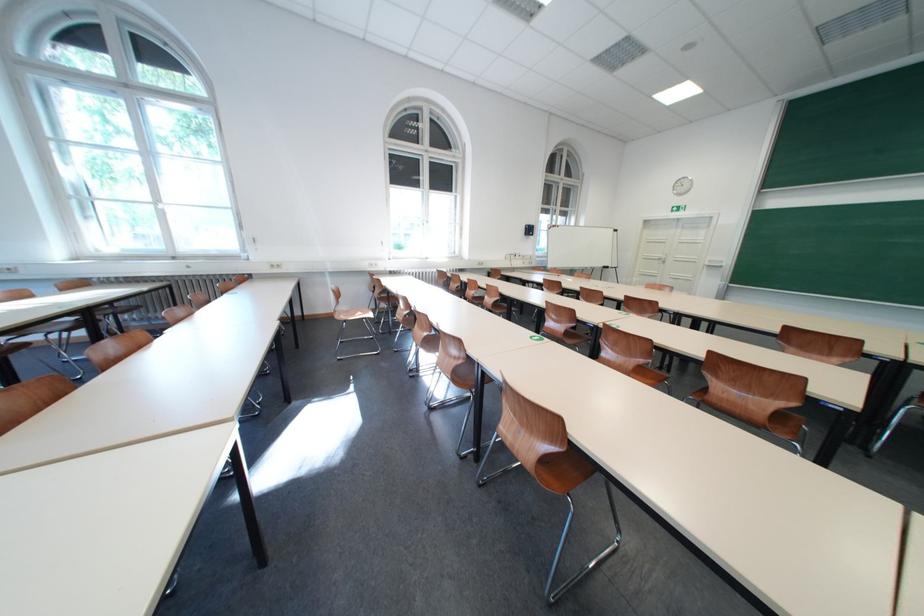
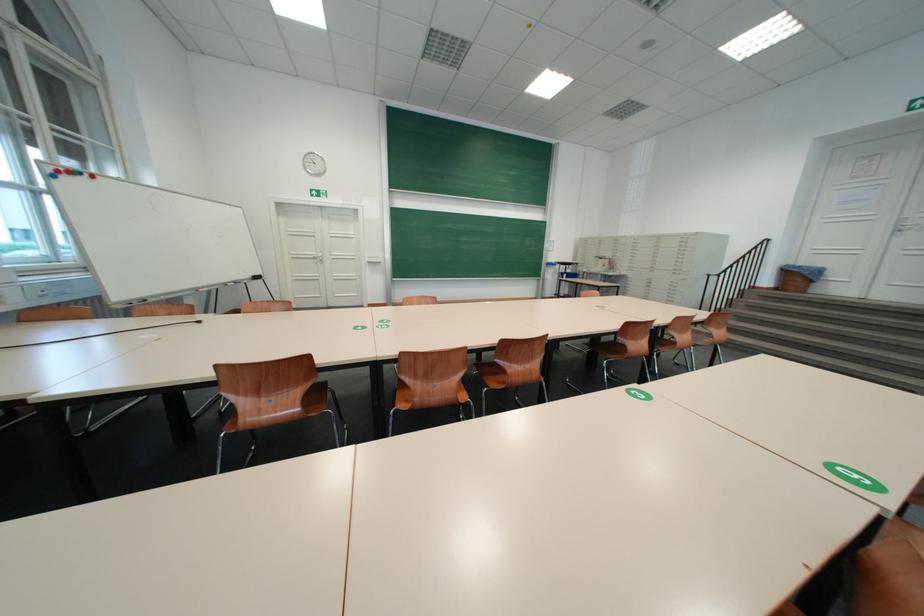
Where in the second image is the point corresponding to point (568, 228) from the first image?

(88, 175)